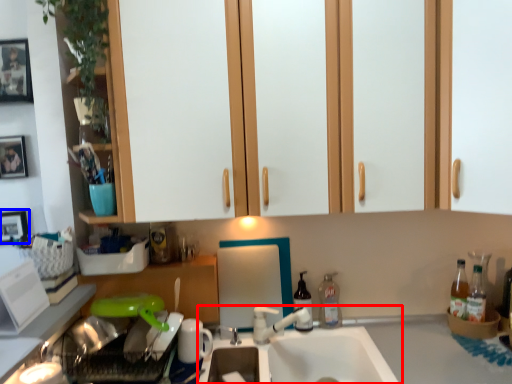
Question: Which object appears closest to the camera in this image, sink (highlighted by a red box) or picture frame (highlighted by a blue box)?

Choices:
 (A) sink
 (B) picture frame

Answer: (A)